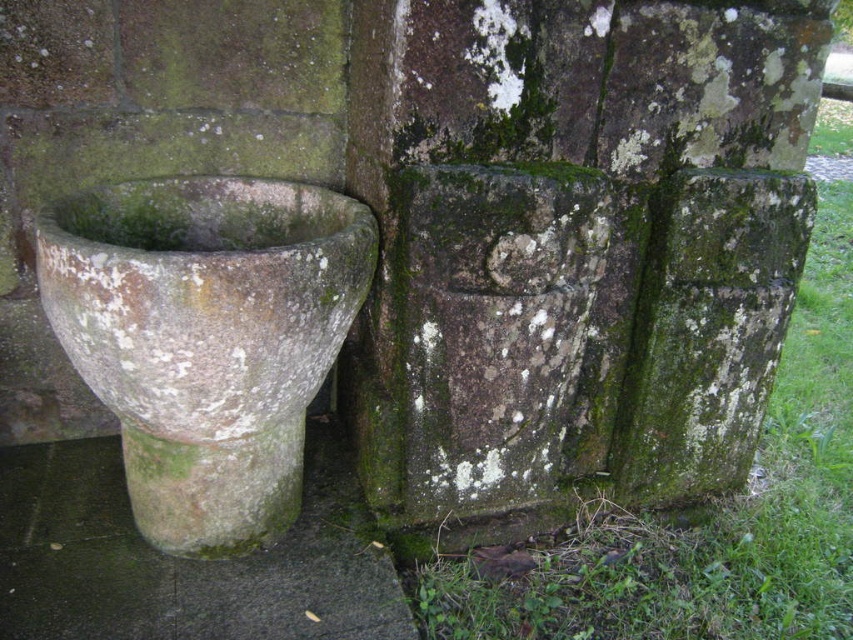
You are standing in front of the stone wall and see the green mossy stone at center and the green mossy stone pot at lower left. Which object is positioned to the right of the other?

The green mossy stone at center is to the right of the green mossy stone pot at lower left.

You are standing in front of the stone wall and want to place a small plant between the green mossy stone at center and the green mossy stone pot at lower left. Which direction should you place it to ensure it is between them?

You should place the plant above the green mossy stone pot at lower left and below the green mossy stone at center since the green mossy stone at center is above the green mossy stone pot at lower left.

You are standing 1.5 meters away from a point marked at coordinates (532, 225). Can you reach that point with your arm if your arm length is 0.7 meters?

The distance between you and the point is 1.47 meters, which is slightly less than your arm length of 0.7 meters. Therefore, you cannot reach the point with your arm.